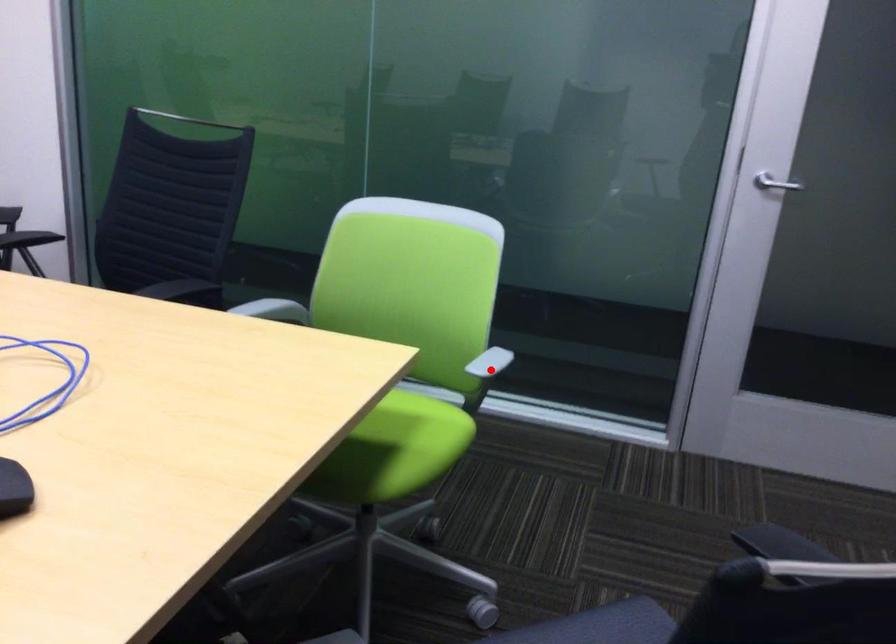
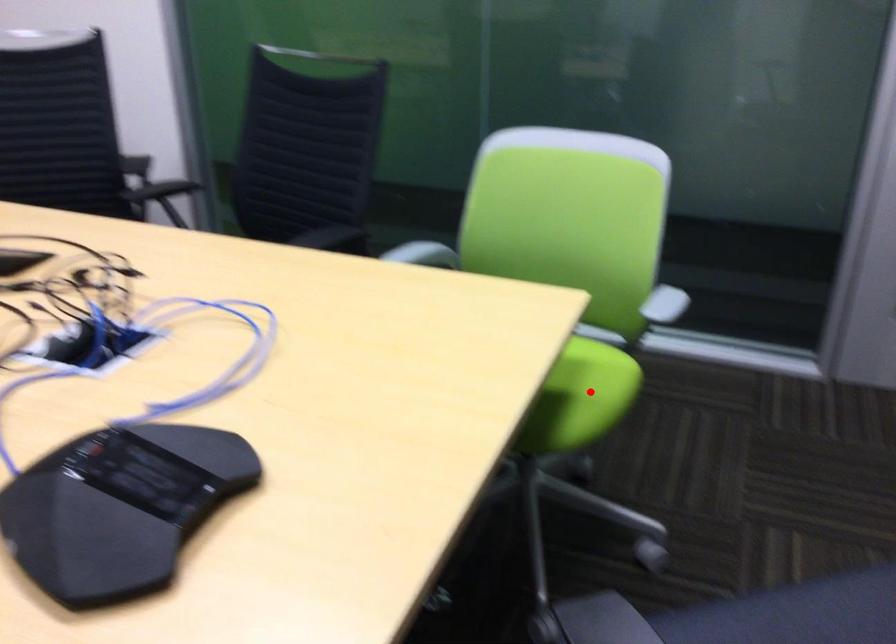
I am providing you with two images of the same scene from different viewpoints. A red point is marked on the first image and another point is marked on the second image. Do the highlighted points in image1 and image2 indicate the same real-world spot?

No